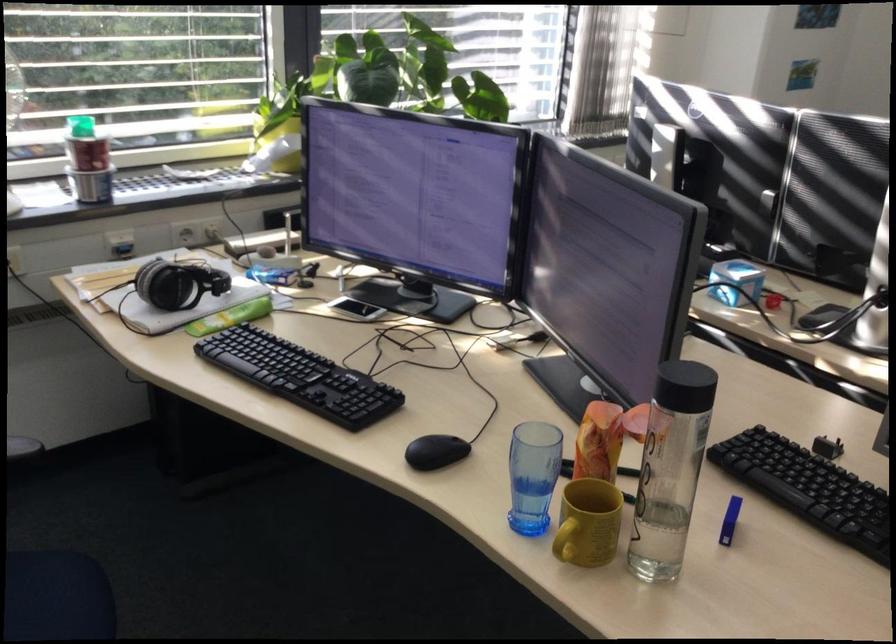
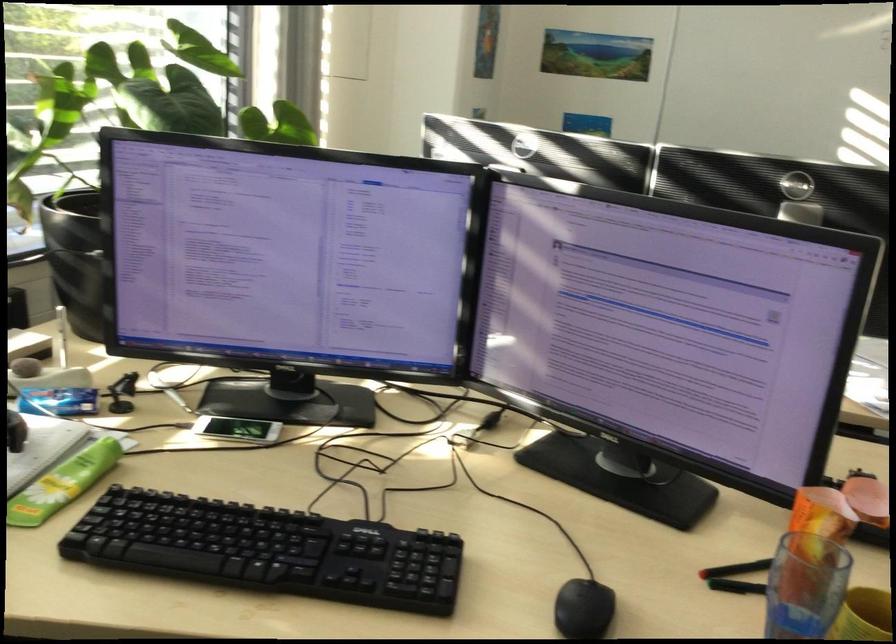
Locate, in the second image, the point that corresponds to (x=679, y=285) in the first image.

(826, 328)